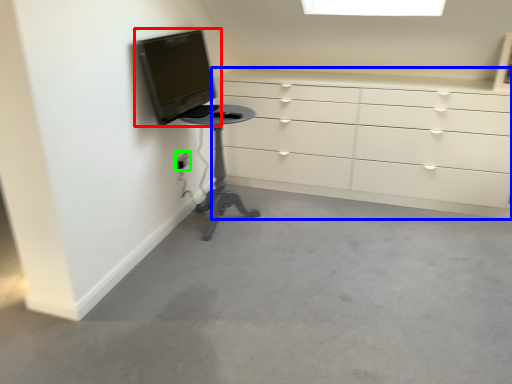
Question: Based on their relative distances, which object is nearer to television (highlighted by a red box)? Choose from chest of drawers (highlighted by a blue box) and electric outlet (highlighted by a green box).

Choices:
 (A) chest of drawers
 (B) electric outlet

Answer: (B)